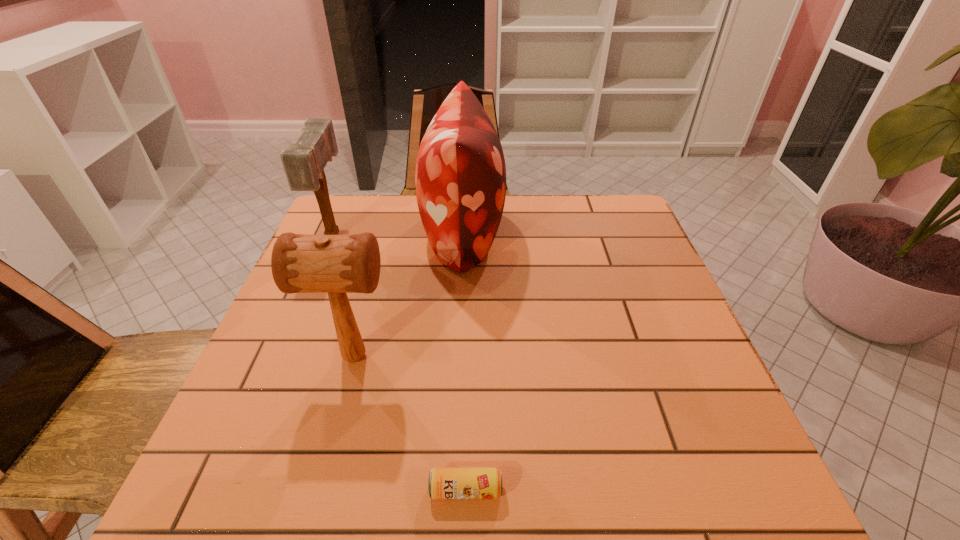
You are a GUI agent. You are given a task and a screenshot of the screen. Output one action in this format:
    pyautogui.click(x=<x>, y=<y>)
    Task: Click on the vacant space at the near left corner of the desktop
    
    Given the screenshot: What is the action you would take?
    pyautogui.click(x=257, y=459)

Locate an element on the screen. vacant space at the far right corner is located at coordinates (632, 225).

This screenshot has height=540, width=960. Identify the location of free region at the near right corner of the desktop. (720, 481).

The image size is (960, 540). I want to click on blank region between the shortest object and the cushion, so click(465, 361).

This screenshot has width=960, height=540. I want to click on free space between the nearest object and the cushion, so click(465, 361).

Find the location of a particular element. This screenshot has width=960, height=540. free point between the cushion and the third farthest object is located at coordinates (409, 294).

At what (x,y) coordinates should I click in order to perform the action: click on vacant region between the cushion and the right mallet. Please return your answer as a coordinate pair (x, y). Looking at the image, I should click on (409, 294).

Locate an element on the screen. vacant area that lies between the cushion and the nearest object is located at coordinates (465, 361).

Where is `free space between the leftmost object and the cushion`? free space between the leftmost object and the cushion is located at coordinates (398, 233).

Image resolution: width=960 pixels, height=540 pixels. I want to click on empty space between the cushion and the farther mallet, so click(398, 233).